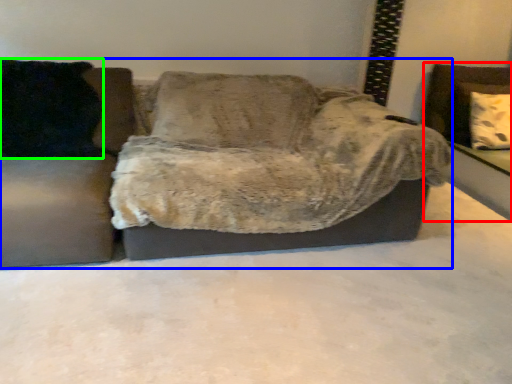
Question: Estimate the real-world distances between objects in this image. Which object is farther from swivel chair (highlighted by a red box), studio couch (highlighted by a blue box) or pillow (highlighted by a green box)?

Choices:
 (A) studio couch
 (B) pillow

Answer: (B)